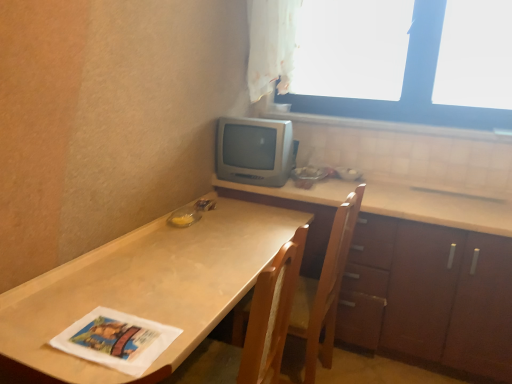
Question: Is the depth of matte brown table at lower left less than that of silver metallic television at center?

Choices:
 (A) yes
 (B) no

Answer: (A)

Question: Does matte brown table at lower left have a smaller size compared to silver metallic television at center?

Choices:
 (A) yes
 (B) no

Answer: (B)

Question: Are matte brown table at lower left and silver metallic television at center making contact?

Choices:
 (A) yes
 (B) no

Answer: (B)

Question: Is matte brown table at lower left looking in the opposite direction of silver metallic television at center?

Choices:
 (A) no
 (B) yes

Answer: (A)

Question: From a real-world perspective, is matte brown table at lower left beneath silver metallic television at center?

Choices:
 (A) yes
 (B) no

Answer: (A)

Question: Is silver metallic television at center located within matte brown table at lower left?

Choices:
 (A) yes
 (B) no

Answer: (B)

Question: Could silver metallic television at center be considered to be inside white tile at upper right?

Choices:
 (A) yes
 (B) no

Answer: (B)

Question: Can you see white tile at upper right touching silver metallic television at center?

Choices:
 (A) no
 (B) yes

Answer: (A)

Question: Can you confirm if white tile at upper right is thinner than silver metallic television at center?

Choices:
 (A) yes
 (B) no

Answer: (A)

Question: From the image's perspective, is white tile at upper right above silver metallic television at center?

Choices:
 (A) no
 (B) yes

Answer: (B)

Question: Does white tile at upper right appear on the right side of silver metallic television at center?

Choices:
 (A) no
 (B) yes

Answer: (B)

Question: Is white tile at upper right in front of silver metallic television at center?

Choices:
 (A) yes
 (B) no

Answer: (B)

Question: From a real-world perspective, does white sheer curtain at upper center sit lower than wooden cabinet at right?

Choices:
 (A) yes
 (B) no

Answer: (B)